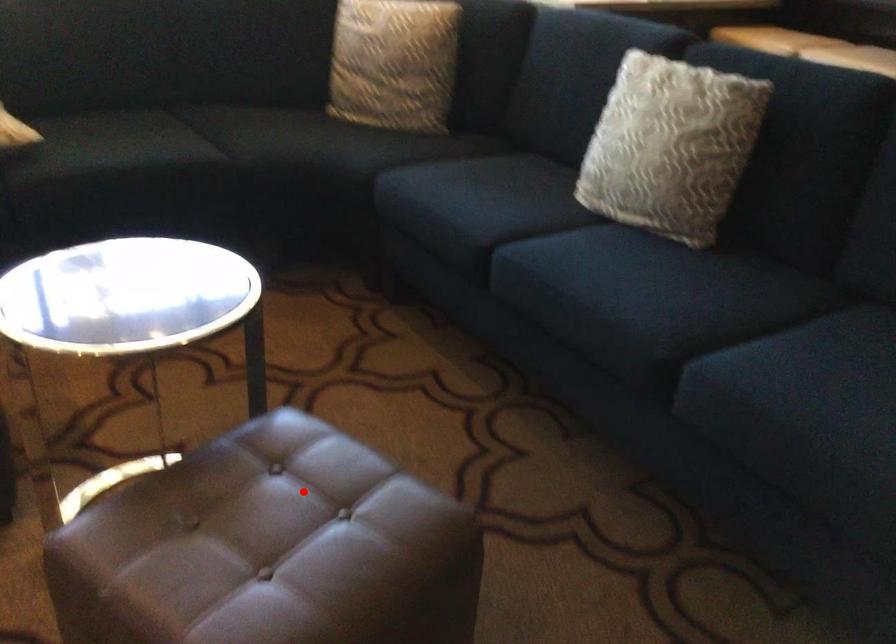
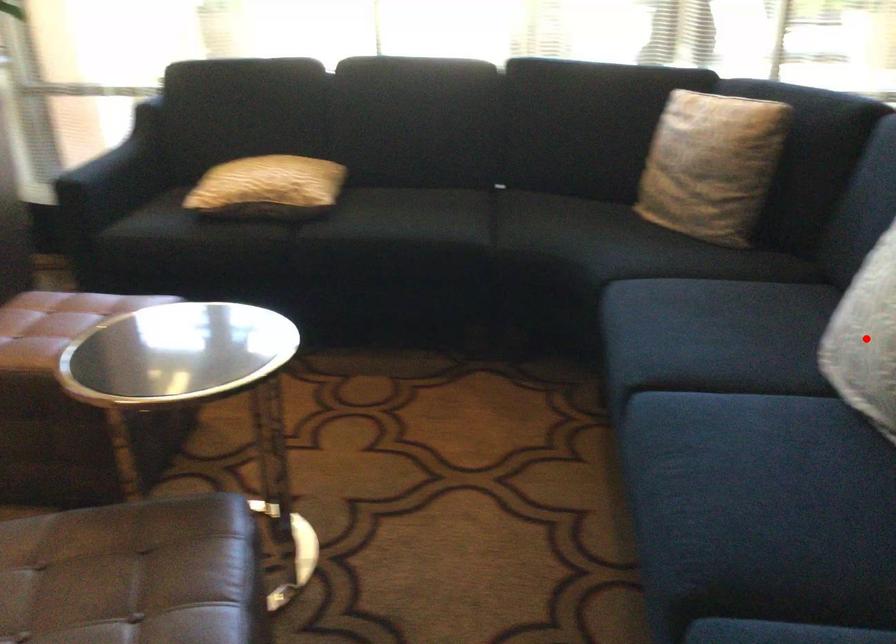
I am providing you with two images of the same scene from different viewpoints. A red point is marked on the first image and another point is marked on the second image. Does the point marked in image1 correspond to the same location as the one in image2?

No